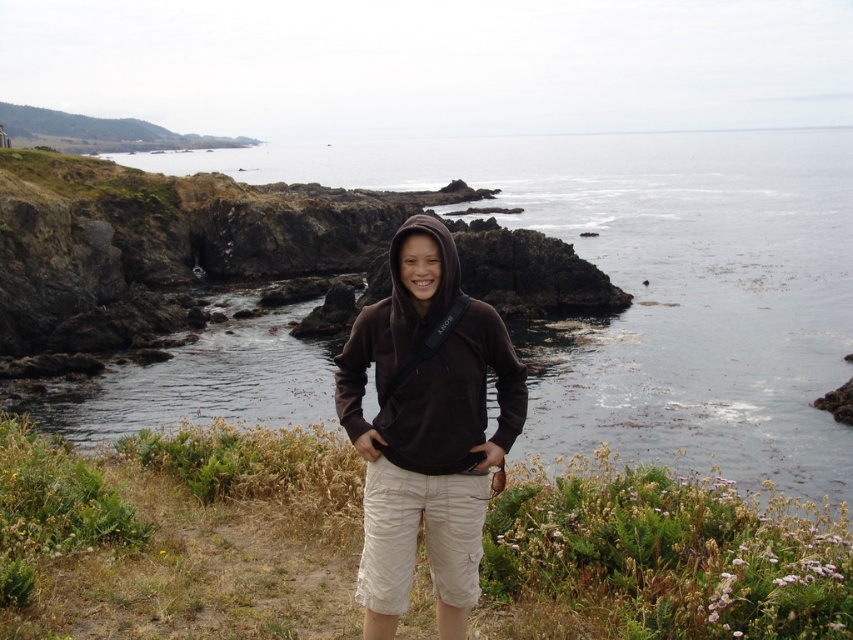
Question: Among these points, which one is farthest from the camera?

Choices:
 (A) (642, 477)
 (B) (699, 161)

Answer: (B)

Question: Which point is closer to the camera taking this photo?

Choices:
 (A) (10, 620)
 (B) (648, 365)

Answer: (A)

Question: Where is brown cotton hoodie at center located in relation to brown fleece hoodie at center in the image?

Choices:
 (A) below
 (B) above

Answer: (A)

Question: Can you confirm if clear water at center is positioned to the right of brown cotton hoodie at center?

Choices:
 (A) no
 (B) yes

Answer: (B)

Question: Estimate the real-world distances between objects in this image. Which object is farther from the clear water at center?

Choices:
 (A) brown fleece hoodie at center
 (B) brown cotton hoodie at center

Answer: (B)

Question: Where is brown cotton hoodie at center located in relation to brown fleece hoodie at center in the image?

Choices:
 (A) below
 (B) above

Answer: (A)